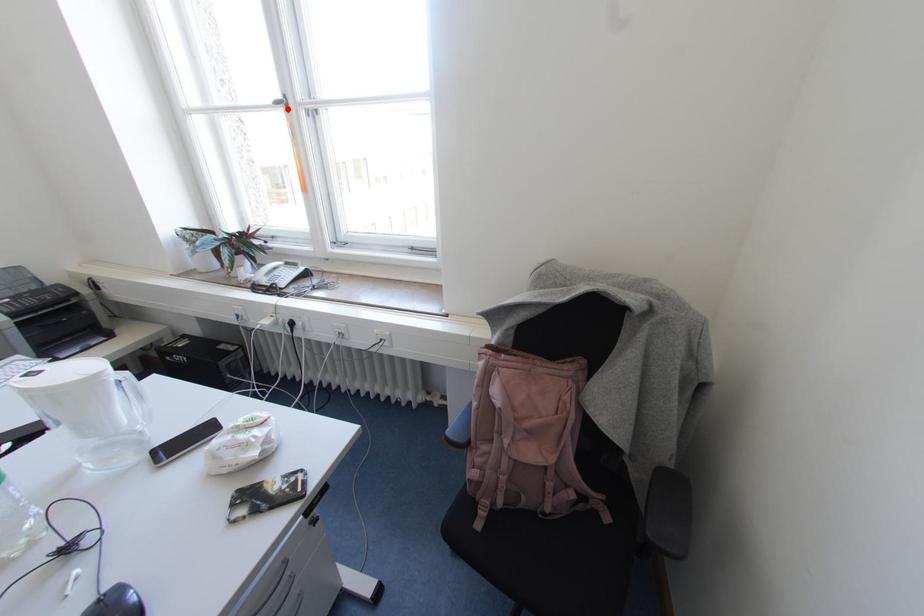
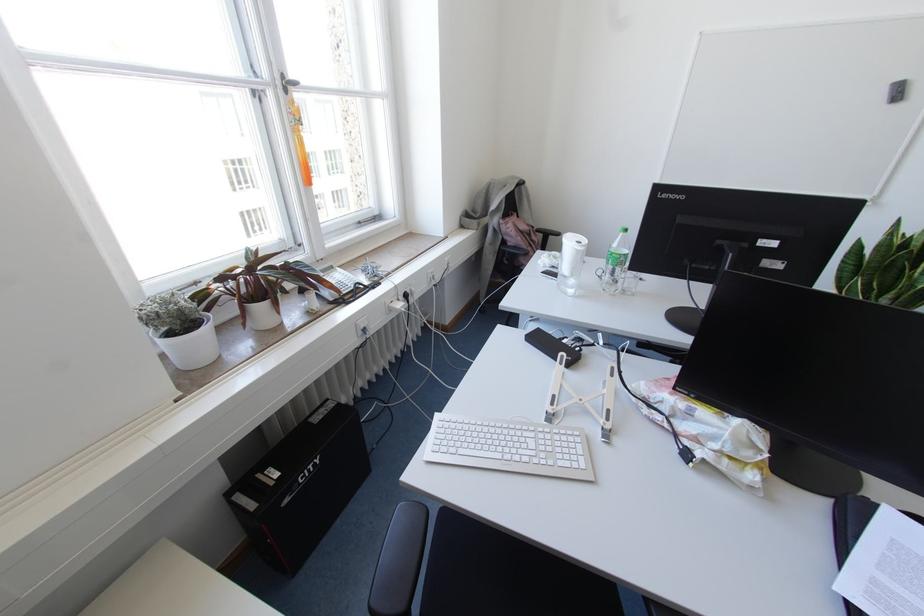
In the second image, find the point that corresponds to the highlighted location in the first image.

(285, 90)